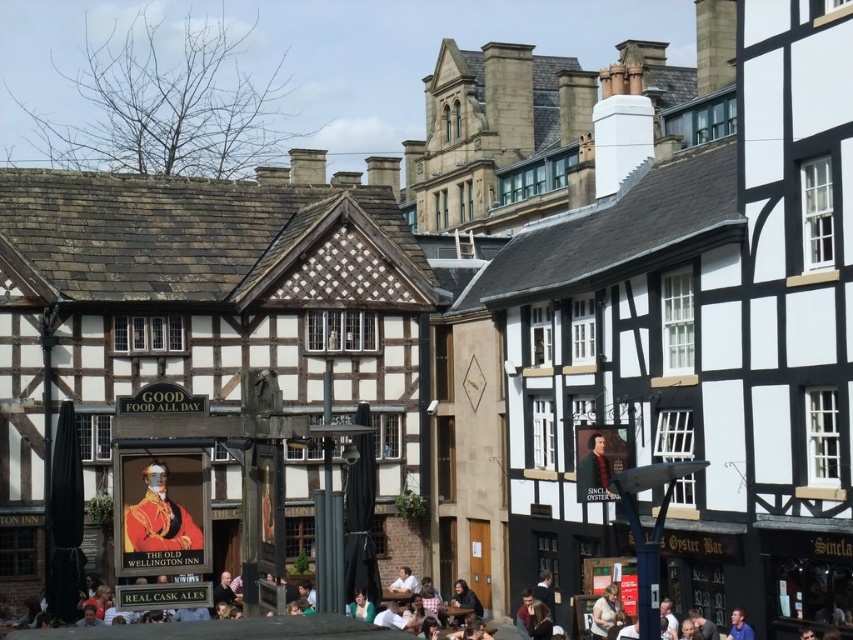
Question: Considering the real-world distances, which object is closest to the green fabric jacket at lower center?

Choices:
 (A) gold textured uniform at center
 (B) light brown leather jacket at lower center
 (C) blue shirt at lower right

Answer: (B)

Question: Is green fabric jacket at lower center wider than blue shirt at lower right?

Choices:
 (A) no
 (B) yes

Answer: (B)

Question: Is white casual clothing at lower center behind green fabric jacket at lower center?

Choices:
 (A) no
 (B) yes

Answer: (A)

Question: Can you confirm if gold textured uniform at center is wider than blue shirt at lower right?

Choices:
 (A) no
 (B) yes

Answer: (B)

Question: Estimate the real-world distances between objects in this image. Which object is farther from the gold textured uniform at center?

Choices:
 (A) green fabric jacket at lower center
 (B) white casual clothing at lower center
 (C) light brown leather jacket at lower center
 (D) blue shirt at lower right

Answer: (D)

Question: Which point is closer to the camera?

Choices:
 (A) (606, 604)
 (B) (160, 484)

Answer: (B)